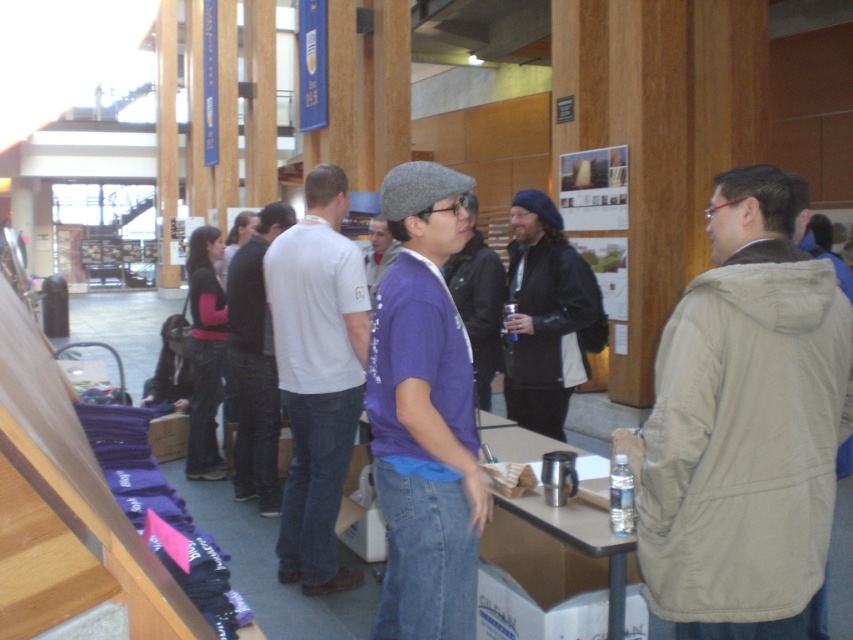
Question: Which object is positioned closest to the white cotton t-shirt at center?

Choices:
 (A) purple matte shirt at center
 (B) matte purple t-shirt at center
 (C) black leather jacket at center

Answer: (C)

Question: Among these points, which one is nearest to the camera?

Choices:
 (A) coord(561,385)
 (B) coord(746,426)

Answer: (B)

Question: Can you confirm if tan fabric jacket at right is positioned above black cotton shirt at center?

Choices:
 (A) no
 (B) yes

Answer: (A)

Question: Can you confirm if black cotton shirt at center is bigger than purple matte shirt at center?

Choices:
 (A) yes
 (B) no

Answer: (A)

Question: Based on their relative distances, which object is farther from the black cotton shirt at center?

Choices:
 (A) white cotton t-shirt at center
 (B) matte purple t-shirt at center
 (C) black leather jacket at center

Answer: (B)

Question: Is white cotton t-shirt at center smaller than black cotton shirt at center?

Choices:
 (A) no
 (B) yes

Answer: (B)